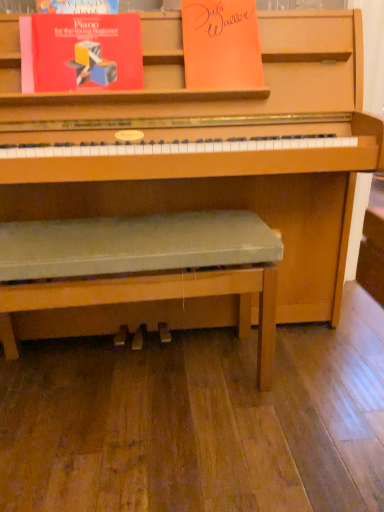
Question: From the image's perspective, is orange paper at upper center, the first paperback book positioned from the right, on matte red book at upper left, which appears as the second paperback book when viewed from the right?

Choices:
 (A) no
 (B) yes

Answer: (B)

Question: Is orange paper at upper center, arranged as the second paperback book when viewed from the left, located outside matte red book at upper left, which ranks as the first paperback book in left-to-right order?

Choices:
 (A) no
 (B) yes

Answer: (B)

Question: Is orange paper at upper center, arranged as the second paperback book when viewed from the left, facing away from matte red book at upper left, which ranks as the first paperback book in left-to-right order?

Choices:
 (A) no
 (B) yes

Answer: (A)

Question: Considering the relative sizes of orange paper at upper center, arranged as the second paperback book when viewed from the left, and matte red book at upper left, which ranks as the first paperback book in left-to-right order, in the image provided, is orange paper at upper center, arranged as the second paperback book when viewed from the left, thinner than matte red book at upper left, which ranks as the first paperback book in left-to-right order,?

Choices:
 (A) no
 (B) yes

Answer: (A)

Question: From a real-world perspective, is orange paper at upper center, arranged as the second paperback book when viewed from the left, positioned under matte red book at upper left, which appears as the second paperback book when viewed from the right, based on gravity?

Choices:
 (A) yes
 (B) no

Answer: (B)

Question: Considering the relative positions of green fabric bench at center and matte red book at upper left, which appears as the second paperback book when viewed from the right, in the image provided, is green fabric bench at center to the left or to the right of matte red book at upper left, which appears as the second paperback book when viewed from the right,?

Choices:
 (A) right
 (B) left

Answer: (A)

Question: Is point (4, 339) positioned closer to the camera than point (114, 13)?

Choices:
 (A) farther
 (B) closer

Answer: (A)

Question: From the image's perspective, relative to matte red book at upper left, which ranks as the first paperback book in left-to-right order, is green fabric bench at center above or below?

Choices:
 (A) below
 (B) above

Answer: (A)

Question: In terms of width, does green fabric bench at center look wider or thinner when compared to matte red book at upper left, which appears as the second paperback book when viewed from the right?

Choices:
 (A) wide
 (B) thin

Answer: (A)

Question: In terms of height, does green fabric bench at center look taller or shorter compared to orange paper at upper center, arranged as the second paperback book when viewed from the left?

Choices:
 (A) tall
 (B) short

Answer: (A)

Question: In the image, is green fabric bench at center positioned in front of or behind orange paper at upper center, arranged as the second paperback book when viewed from the left?

Choices:
 (A) behind
 (B) front

Answer: (B)

Question: Is point (233, 274) positioned closer to the camera than point (236, 29)?

Choices:
 (A) closer
 (B) farther

Answer: (A)

Question: Would you say green fabric bench at center is inside or outside orange paper at upper center, the first paperback book positioned from the right?

Choices:
 (A) outside
 (B) inside

Answer: (A)

Question: Does point (218, 39) appear closer or farther from the camera than point (127, 67)?

Choices:
 (A) closer
 (B) farther

Answer: (B)

Question: From the image's perspective, relative to matte red book at upper left, which ranks as the first paperback book in left-to-right order, is orange paper at upper center, arranged as the second paperback book when viewed from the left, above or below?

Choices:
 (A) above
 (B) below

Answer: (A)